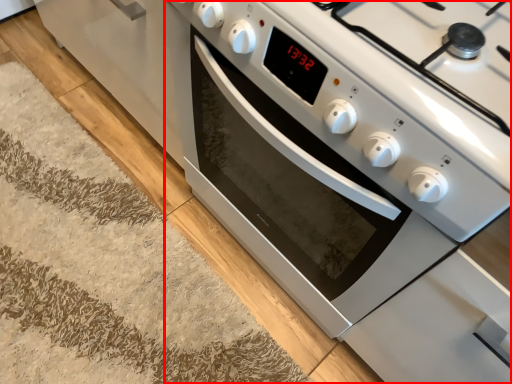
Question: Where is oven (annotated by the red box) located in relation to doormat in the image?

Choices:
 (A) left
 (B) right

Answer: (B)